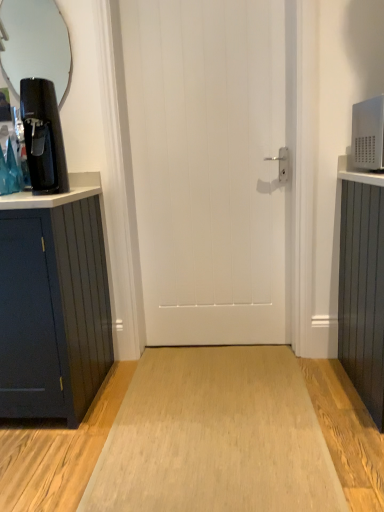
You are a GUI agent. You are given a task and a screenshot of the screen. Output one action in this format:
    pyautogui.click(x=<x>, y=<y>)
    Task: Click on the blank space situated above light wood floor at center (from a real-world perspective)
    Image resolution: width=384 pixels, height=512 pixels.
    Given the screenshot: What is the action you would take?
    pyautogui.click(x=217, y=403)